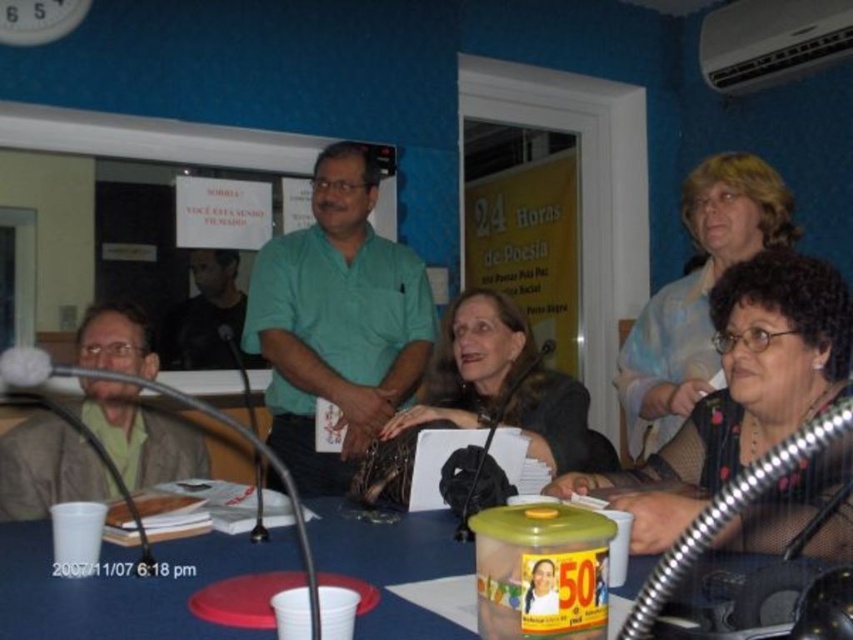
Question: Among these points, which one is nearest to the camera?

Choices:
 (A) (566, 442)
 (B) (425, 348)
 (C) (76, 451)

Answer: (A)

Question: Which object appears farthest from the camera in this image?

Choices:
 (A) matte black jacket at center
 (B) blue plastic table at center
 (C) black matte shirt at center
 (D) brown leather jacket at lower left

Answer: (C)

Question: Does green cotton shirt at center have a lesser width compared to matte blue blouse at upper right?

Choices:
 (A) no
 (B) yes

Answer: (A)

Question: Is matte blue blouse at upper right to the right of black matte shirt at center from the viewer's perspective?

Choices:
 (A) yes
 (B) no

Answer: (A)

Question: Is matte black shirt at center positioned at the back of brown leather jacket at lower left?

Choices:
 (A) yes
 (B) no

Answer: (B)

Question: Among these objects, which one is farthest from the camera?

Choices:
 (A) matte black jacket at center
 (B) brown leather jacket at lower left
 (C) black matte shirt at center

Answer: (C)